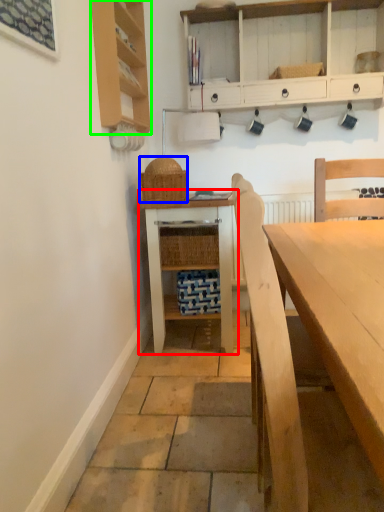
Question: Estimate the real-world distances between objects in this image. Which object is closer to table (highlighted by a red box), picnic basket (highlighted by a blue box) or shelf (highlighted by a green box)?

Choices:
 (A) picnic basket
 (B) shelf

Answer: (A)